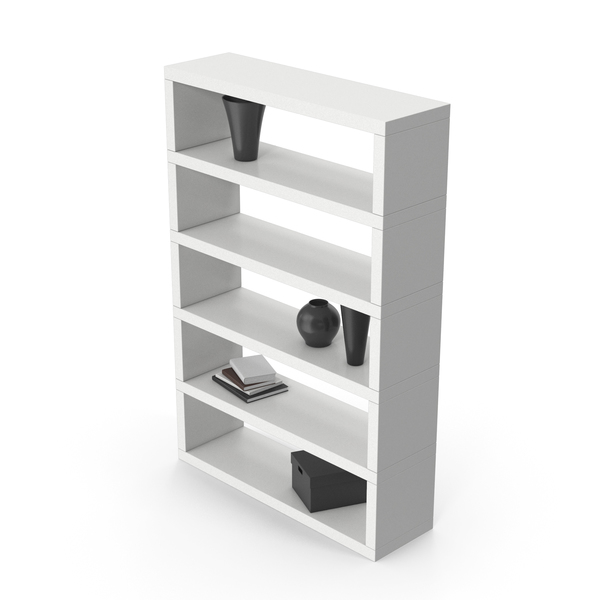
Locate an element on the screen. book shelf is located at coordinates (404, 322), (176, 259), (306, 97), (257, 498).